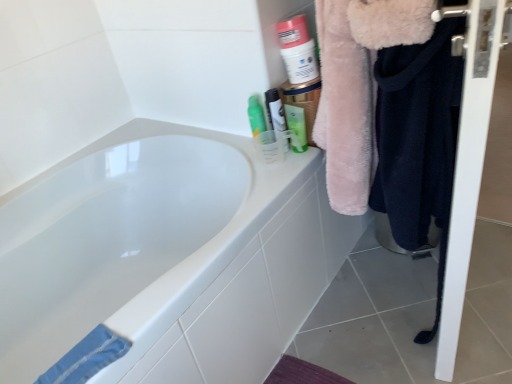
Find the location of a particular element. The width and height of the screenshot is (512, 384). free space that is to the left of green matte tube at upper right, marked as the 1th mouthwash in a right-to-left arrangement is located at coordinates (259, 152).